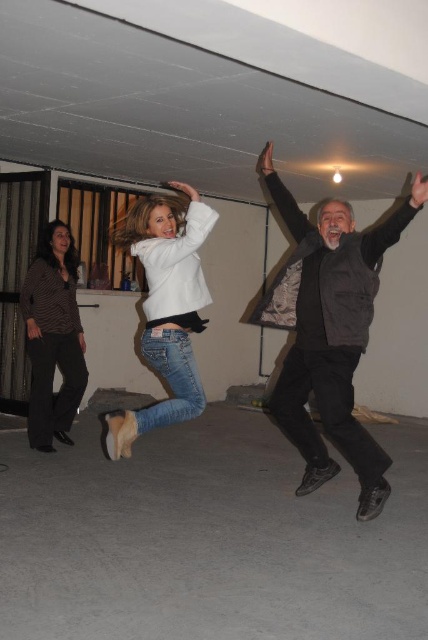
Question: Among these objects, which one is nearest to the camera?

Choices:
 (A) striped jersey pants at left
 (B) black matte arm at upper right
 (C) black matte arm at upper center
 (D) dark gray textured jacket at center

Answer: (D)

Question: Is white matte jacket at center thinner than black matte arm at upper center?

Choices:
 (A) no
 (B) yes

Answer: (A)

Question: Is striped jersey pants at left below black matte arm at upper right?

Choices:
 (A) no
 (B) yes

Answer: (B)

Question: From the image, what is the correct spatial relationship of black matte arm at upper right in relation to dark brown knitted sweater at left?

Choices:
 (A) above
 (B) below

Answer: (A)

Question: Which object is positioned farthest from the dark gray textured jacket at center?

Choices:
 (A) denim jeans at center
 (B) striped jersey pants at left
 (C) black matte arm at upper right

Answer: (B)

Question: Considering the real-world distances, which object is closest to the black matte arm at upper center?

Choices:
 (A) striped jersey pants at left
 (B) black matte arm at upper right
 (C) white matte jacket at center
 (D) dark brown knitted sweater at left

Answer: (B)